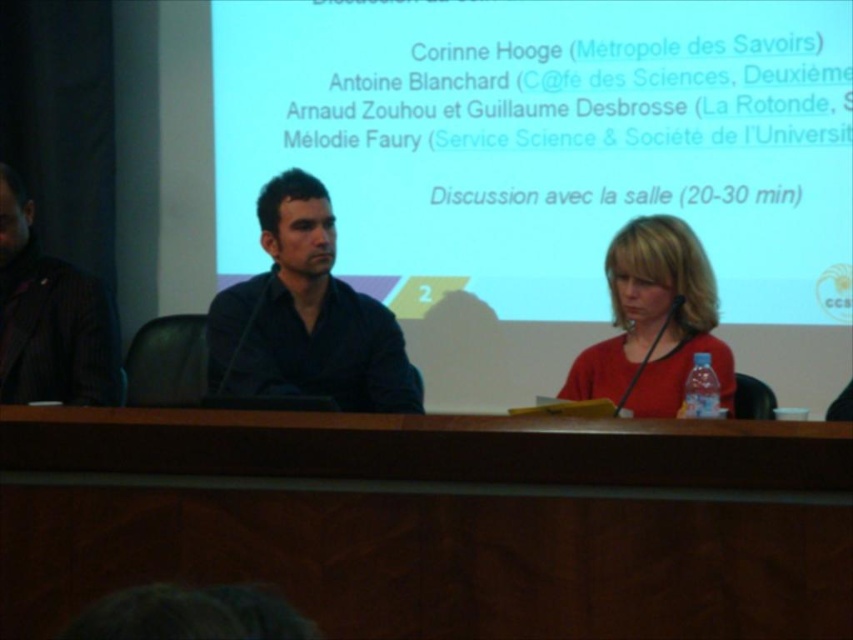
You are an event organizer who needs to ensure that all participants can clearly see the white matte projection screen at center and the matte red blouse at center during the panel discussion. Given their sizes, which object should you position closer to the audience to ensure visibility?

The white matte projection screen at center is larger in size than the matte red blouse at center, so you should position the matte red blouse at center closer to the audience to ensure visibility since it is smaller and needs to be seen clearly.

You are a stage manager preparing for the panel discussion. You need to place a small microphone stand at point (x=592, y=458). The stand requires a minimum of 1.8 meters of space in front of it to avoid blocking the projection screen. Is the available space sufficient?

The distance of point (x=592, y=458) from camera is 1.74 meters. Since the required minimum space is 1.8 meters, the available space is insufficient. The microphone stand cannot be placed there without blocking the projection screen.

You are organizing a panel discussion and need to place a 1.5 meter wide banner between the white matte projection screen at center and the wooden table at center. Will there be enough space for the banner to fit without overlapping either object?

The distance between the white matte projection screen at center and the wooden table at center is 1.87 meters. Since the banner is 1.5 meters wide, there is sufficient space to place it between them without overlapping either object.